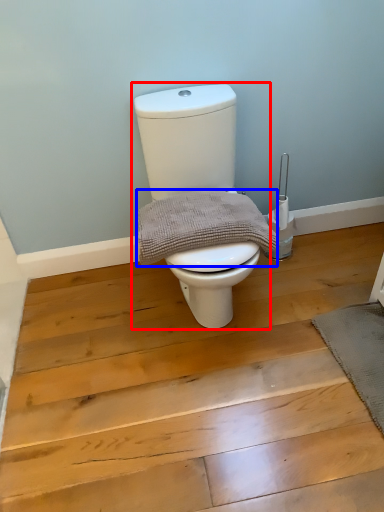
Question: Which of the following is the farthest to the observer, toilet (highlighted by a red box) or material (highlighted by a blue box)?

Choices:
 (A) toilet
 (B) material

Answer: (B)